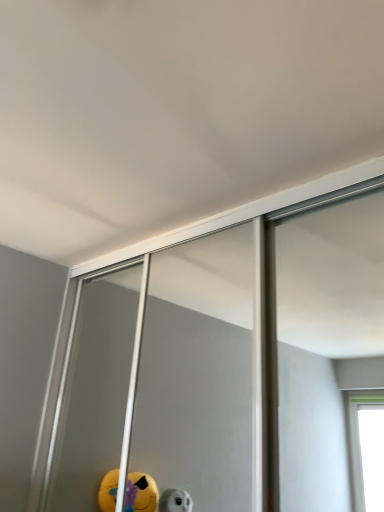
This screenshot has height=512, width=384. What do you see at coordinates (164, 382) in the screenshot?
I see `clear glass screen door at upper center` at bounding box center [164, 382].

What is the approximate height of clear glass screen door at upper center?

1.11 meters.

Where is `clear glass screen door at upper center`? This screenshot has height=512, width=384. clear glass screen door at upper center is located at coordinates (164, 382).

Locate an element on the screen. Image resolution: width=384 pixels, height=512 pixels. clear glass screen door at upper center is located at coordinates [x=164, y=382].